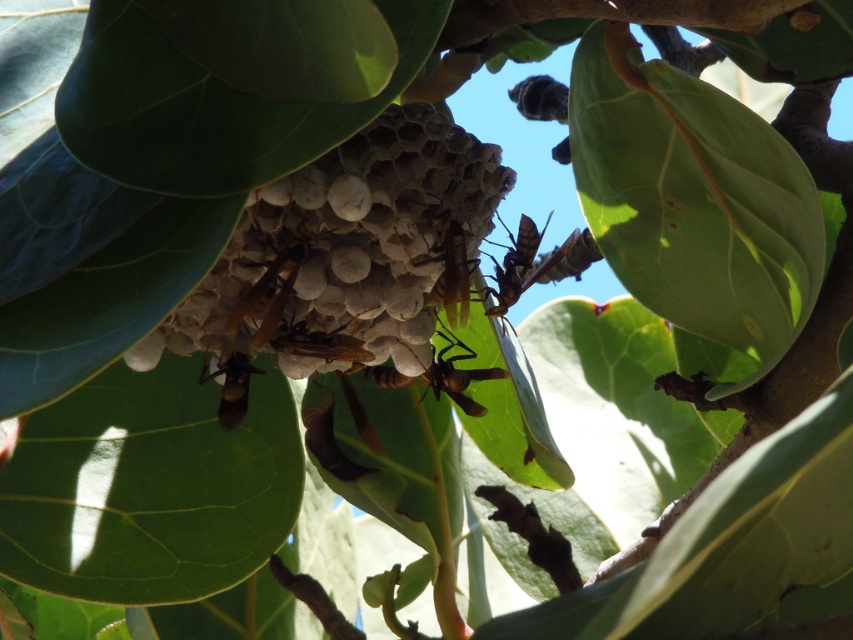
Consider the image. Can you confirm if white honeycomb at center is wider than brown matte bee at center?

Correct, the width of white honeycomb at center exceeds that of brown matte bee at center.

Measure the distance between white honeycomb at center and brown matte bee at center.

white honeycomb at center and brown matte bee at center are 15.62 centimeters apart from each other.

Who is more forward, (399, 256) or (439, 385)?

Point (399, 256)

The height and width of the screenshot is (640, 853). Find the location of `white honeycomb at center`. white honeycomb at center is located at coordinates (349, 252).

Looking at this image, can you confirm if green matte leaf at center is thinner than brown glossy wasp at center?

No.

At what (x,y) coordinates should I click in order to perform the action: click on green matte leaf at center. Please return your answer as a coordinate pair (x, y). The width and height of the screenshot is (853, 640). Looking at the image, I should click on (693, 200).

Identify the location of green matte leaf at center. (693, 200).

Between point (300, 330) and point (585, 211), which one is positioned in front?

Positioned in front is point (300, 330).

Does white honeycomb at center appear under green matte leaf at center?

Indeed, white honeycomb at center is positioned under green matte leaf at center.

Is point (361, 138) farther from viewer compared to point (688, 305)?

No, it is in front of (688, 305).

You are a GUI agent. You are given a task and a screenshot of the screen. Output one action in this format:
    pyautogui.click(x=<x>, y=<y>)
    Task: Click on the white honeycomb at center
    The width and height of the screenshot is (853, 640).
    Given the screenshot: What is the action you would take?
    pyautogui.click(x=349, y=252)